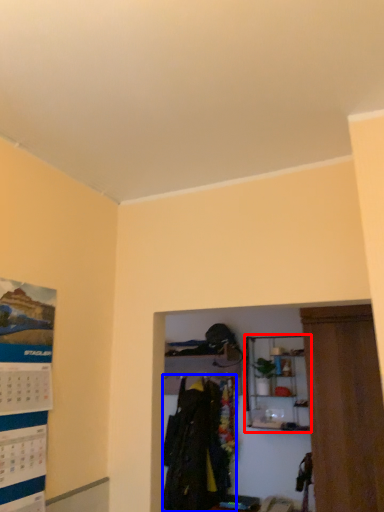
Question: Which object appears closest to the camera in this image, shelf (highlighted by a red box) or clothing (highlighted by a blue box)?

Choices:
 (A) shelf
 (B) clothing

Answer: (A)